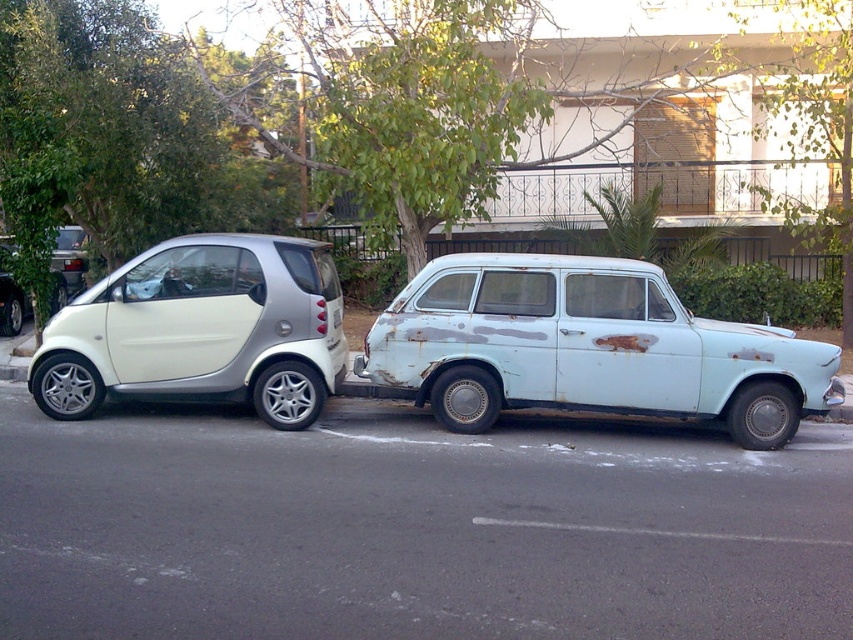
Is rusty metal car at right to the right of metallic silver car at left from the viewer's perspective?

Yes, rusty metal car at right is to the right of metallic silver car at left.

Does point (833, 396) come behind point (55, 410)?

No, it is in front of (55, 410).

The image size is (853, 640). Identify the location of rusty metal car at right. (589, 348).